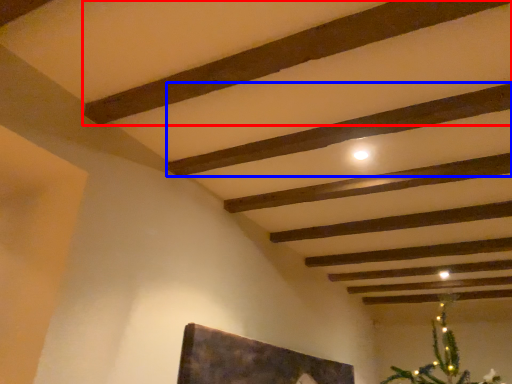
Question: Which point is closer to the camera, plank (highlighted by a red box) or plank (highlighted by a blue box)?

Choices:
 (A) plank
 (B) plank

Answer: (A)